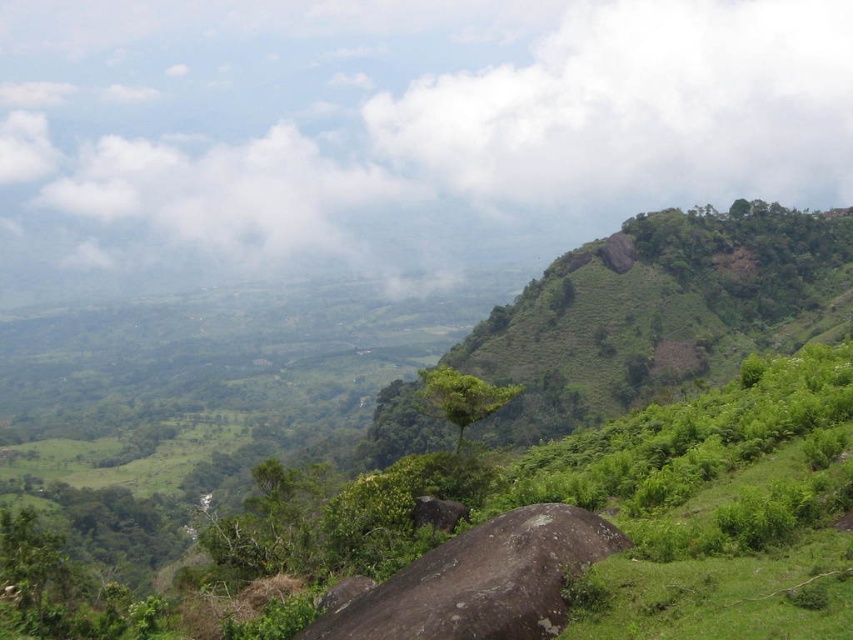
Who is taller, gray rough boulder at center or green leafy tree at center?

With more height is green leafy tree at center.

Can you confirm if gray rough boulder at center is positioned to the left of green leafy tree at center?

Incorrect, gray rough boulder at center is not on the left side of green leafy tree at center.

I want to click on gray rough boulder at center, so click(x=482, y=580).